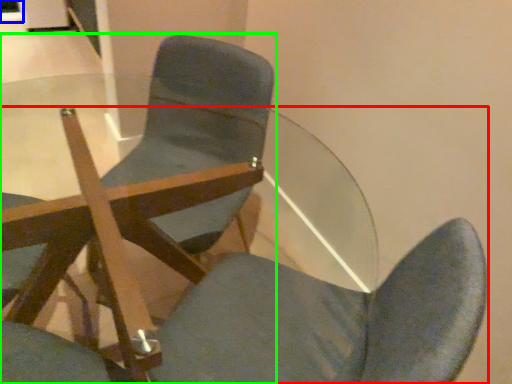
Question: Which object is the closest to the chair (highlighted by a red box)? Choose among these: glass door (highlighted by a blue box) or chair (highlighted by a green box).

Choices:
 (A) glass door
 (B) chair

Answer: (B)